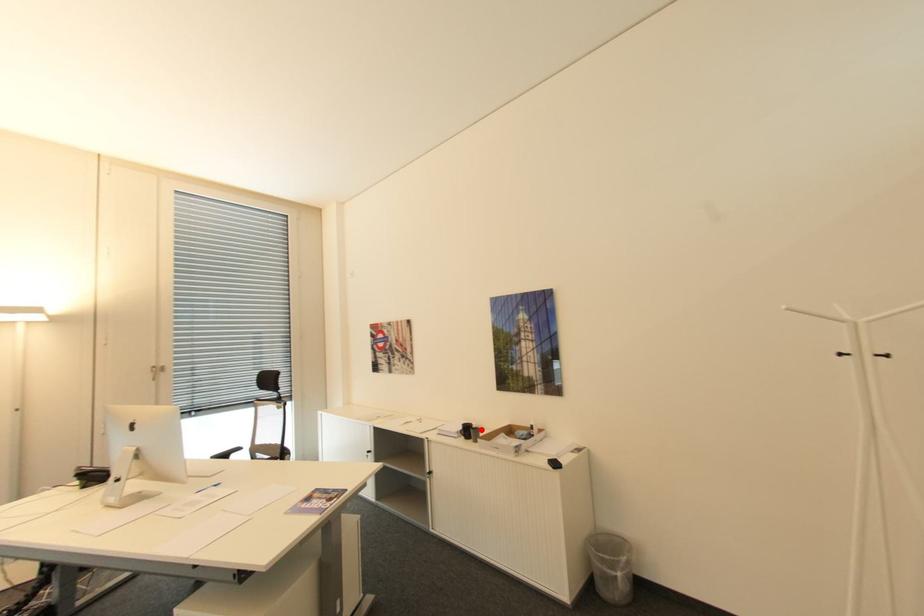
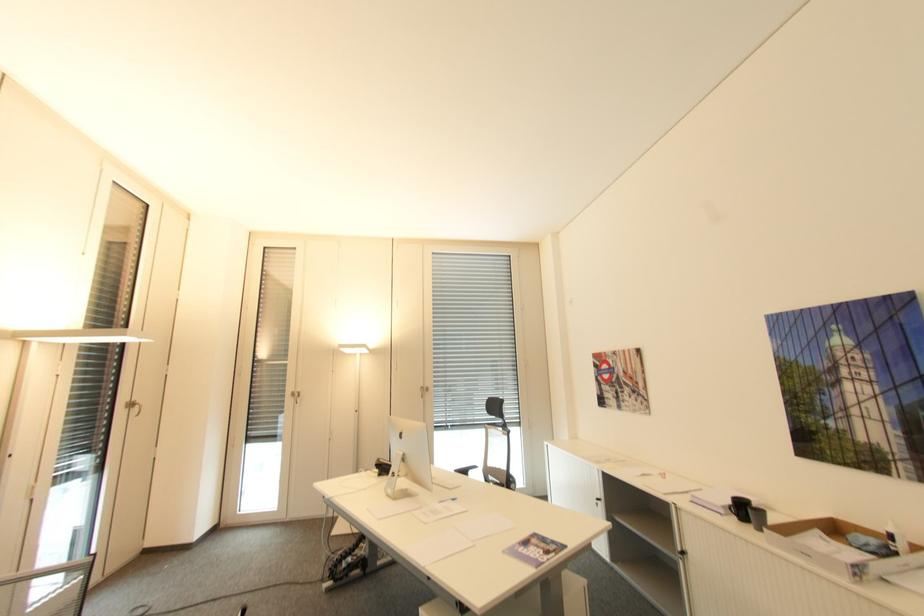
In the second image, find the point that corresponds to the highlighted location in the first image.

(766, 513)